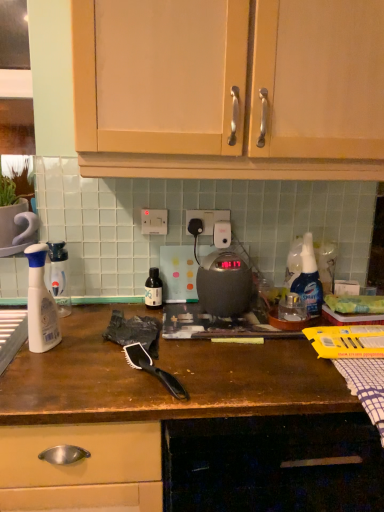
Locate an element on the screen. Image resolution: width=384 pixels, height=512 pixels. blank space situated above brown matte countertop at center, the 1th cabinetry ordered from the bottom (from a real-world perspective) is located at coordinates (181, 350).